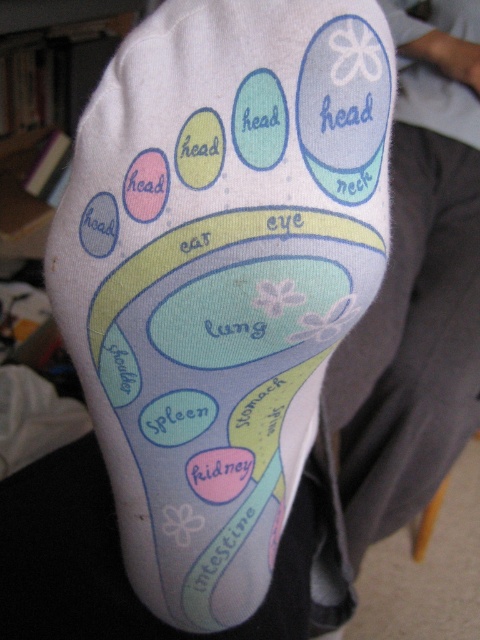
You are examining the sock and want to determine the spatial relationship between the white fabric paw print at center and the white fabric at upper right. Which one is closer to you?

The white fabric paw print at center is closer to the viewer than the white fabric at upper right.